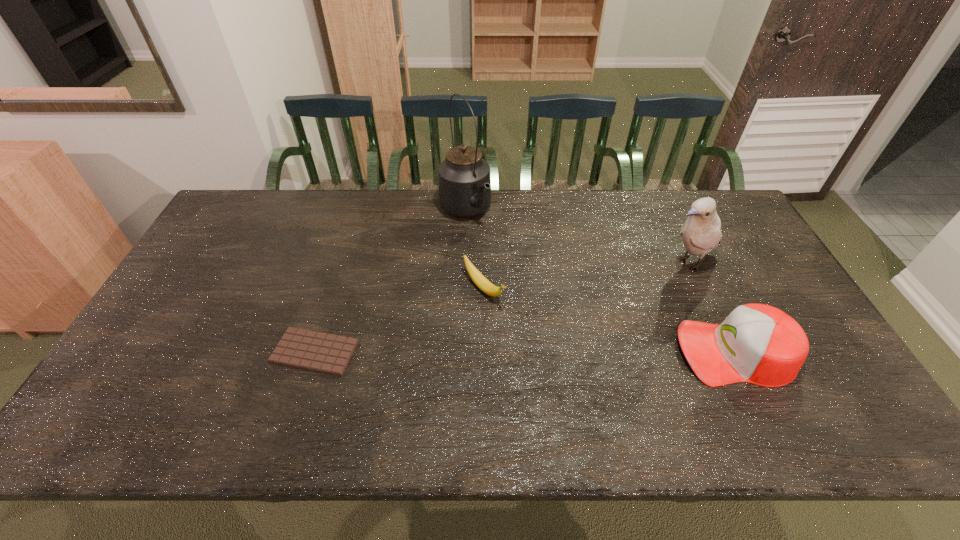
Where is `free spot located 0.330m on the front-facing side of the third shortest object`? This screenshot has height=540, width=960. free spot located 0.330m on the front-facing side of the third shortest object is located at coordinates (550, 352).

This screenshot has height=540, width=960. Identify the location of free location located at the stem of the second shortest object. (550, 359).

Find the location of a particular element. The height and width of the screenshot is (540, 960). free location located 0.050m at the stem of the second shortest object is located at coordinates (508, 317).

The width and height of the screenshot is (960, 540). Find the location of `vacant space located 0.230m at the stem of the second shortest object`. vacant space located 0.230m at the stem of the second shortest object is located at coordinates (553, 362).

The image size is (960, 540). What are the coordinates of `vacant space located at the beak of the second tallest object` in the screenshot? It's located at (587, 309).

The width and height of the screenshot is (960, 540). I want to click on free spot located 0.150m at the beak of the second tallest object, so click(626, 289).

The height and width of the screenshot is (540, 960). What are the coordinates of `free space located at the beak of the second tallest object` in the screenshot? It's located at (587, 309).

Where is `vacant space located spout on the farthest object`? The image size is (960, 540). vacant space located spout on the farthest object is located at coordinates (497, 254).

Find the location of a particular element. The width and height of the screenshot is (960, 540). vacant space located 0.390m spout on the farthest object is located at coordinates (543, 309).

I want to click on free space located 0.250m spout on the farthest object, so click(x=517, y=278).